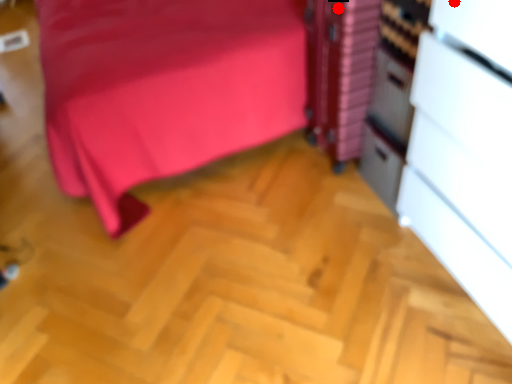
Question: Two points are circled on the image, labeled by A and B beside each circle. Which point appears closest to the camera in this image?

Choices:
 (A) A is closer
 (B) B is closer

Answer: (A)